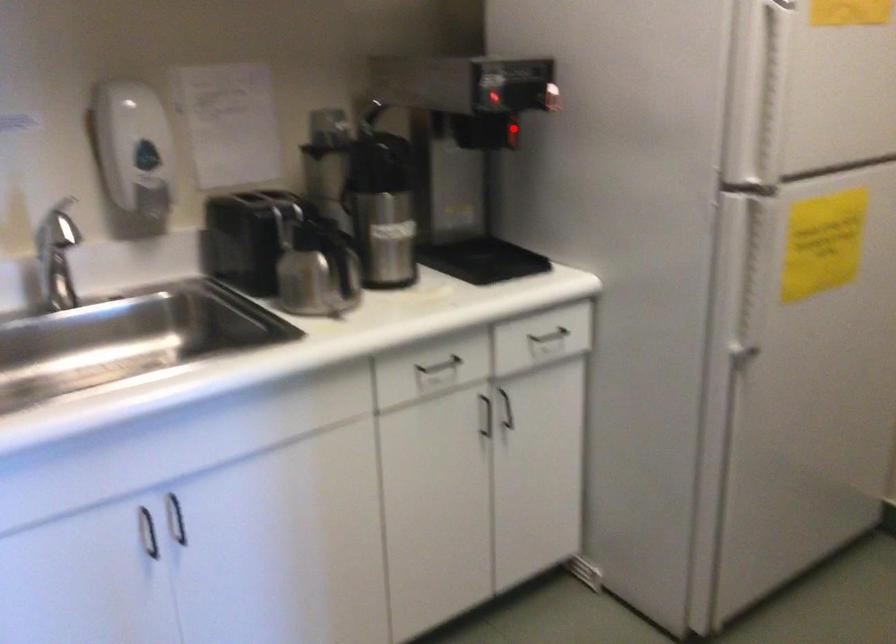
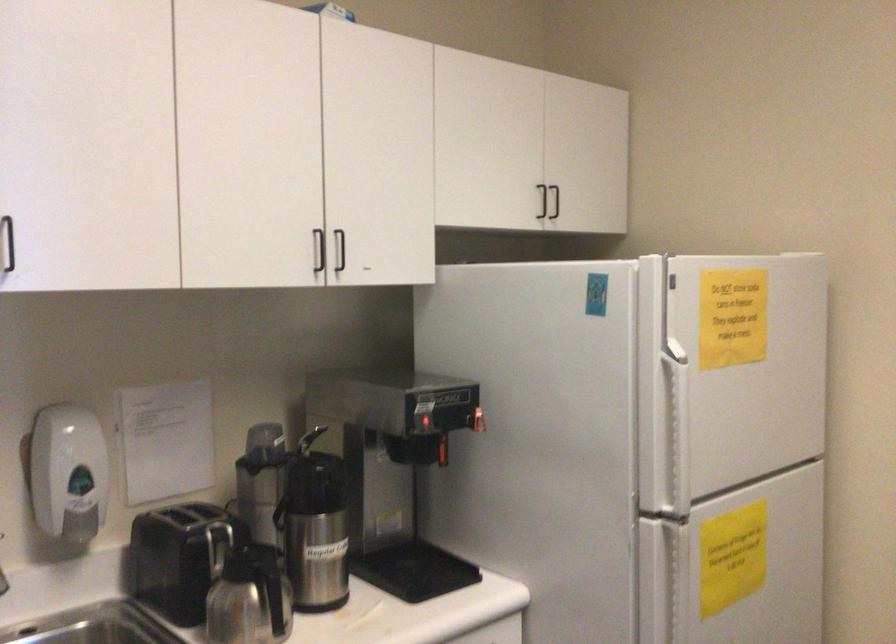
In the second image, find the point that corresponds to the highlighted location in the first image.

(442, 451)